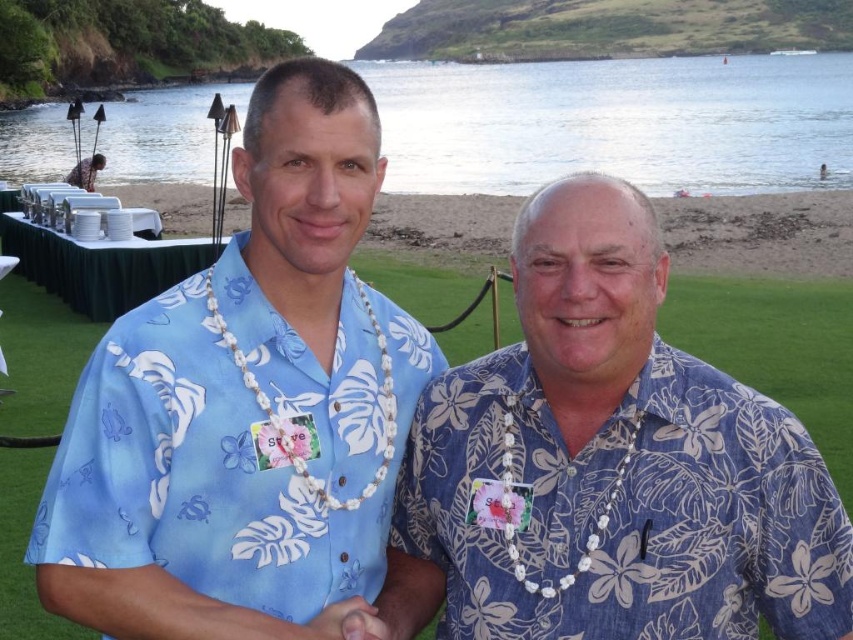
Who is positioned more to the right, blue floral shirt at center or clear water at beach left?

clear water at beach left

Can you confirm if blue floral shirt at center is shorter than clear water at beach left?

Yes.

Who is more forward, (235, 636) or (480, 168)?

Point (235, 636) is in front.

Locate an element on the screen. blue floral shirt at center is located at coordinates (247, 406).

Does blue floral print shirt at center have a lesser height compared to clear water at beach left?

Correct, blue floral print shirt at center is not as tall as clear water at beach left.

Between blue floral print shirt at center and clear water at beach left, which one is positioned higher?

clear water at beach left

Image resolution: width=853 pixels, height=640 pixels. Describe the element at coordinates (624, 509) in the screenshot. I see `blue floral print shirt at center` at that location.

This screenshot has width=853, height=640. In order to click on blue floral print shirt at center in this screenshot , I will do `click(624, 509)`.

Does green grass at center appear over beach sand at lower center?

No.

Can you confirm if green grass at center is bigger than beach sand at lower center?

Incorrect, green grass at center is not larger than beach sand at lower center.

I want to click on green grass at center, so click(x=776, y=348).